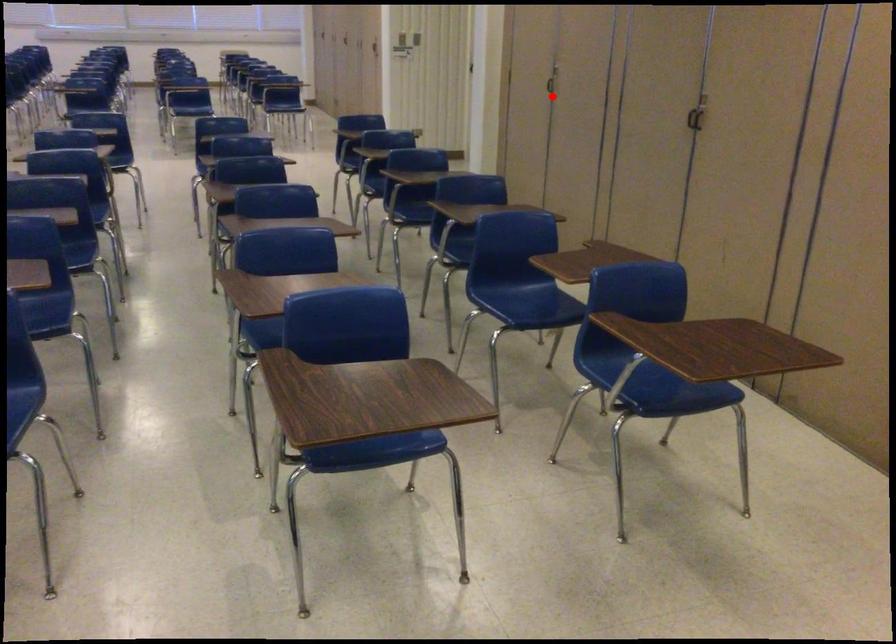
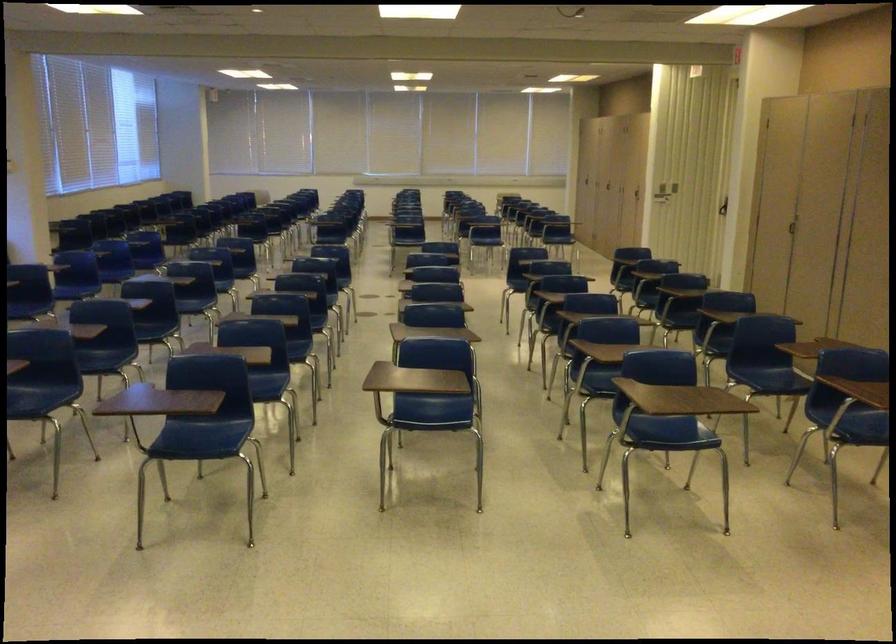
Question: I am providing you with two images of the same scene from different viewpoints. A red point is shown in image1. For the corresponding object point in image2, is it positioned nearer or farther from the camera?

Choices:
 (A) Nearer
 (B) Farther

Answer: (B)